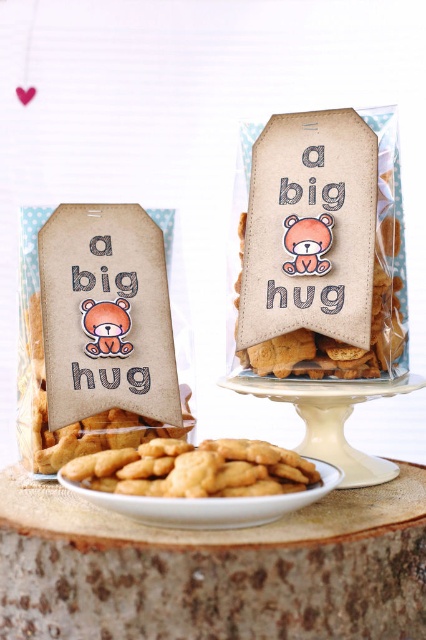
You are holding a camera and want to take a photo of the point at coordinates (x=317, y=148). The camera has a focus range of 15 inches. Will the point be in focus?

The point at coordinates (x=317, y=148) is 16.36 inches away from the camera, which is beyond the camera focus range of 15 inches. Therefore, the point will not be in focus.